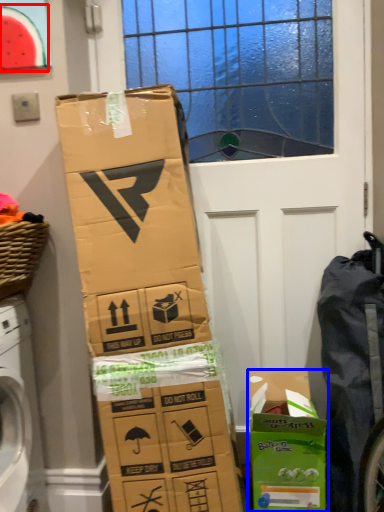
Question: Which object is closer to the camera taking this photo, watermelon (highlighted by a red box) or cardboard box (highlighted by a blue box)?

Choices:
 (A) watermelon
 (B) cardboard box

Answer: (B)